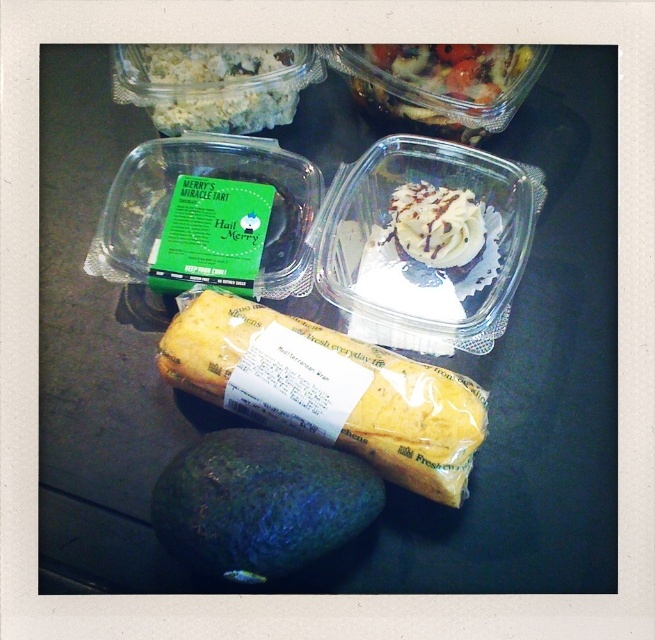
Question: Among these points, which one is farthest from the camera?

Choices:
 (A) (121, 60)
 (B) (388, 60)
 (C) (462, 246)
 (D) (409, 369)

Answer: (B)

Question: Is yellowish-brown bread at center to the right of white frosted cupcake at center from the viewer's perspective?

Choices:
 (A) yes
 (B) no

Answer: (B)

Question: Which point appears closest to the camera in this image?

Choices:
 (A) (272, 358)
 (B) (286, 442)
 (C) (451, 212)

Answer: (B)

Question: Is the position of green matte avocado at lower center less distant than that of white frosted cupcake at center?

Choices:
 (A) no
 (B) yes

Answer: (B)

Question: Does yellowish-brown bread at center appear under green matte avocado at lower center?

Choices:
 (A) yes
 (B) no

Answer: (B)

Question: Which point is farther to the camera?

Choices:
 (A) white frosted cupcake at center
 (B) green matte avocado at lower center

Answer: (A)